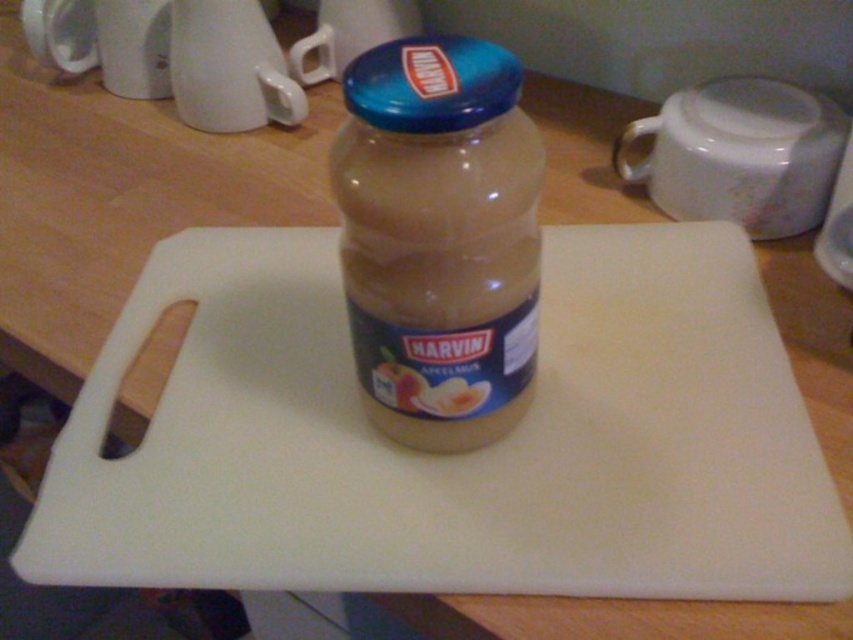
Question: Is translucent glass jar at center positioned at the back of blue metallic lid at center?

Choices:
 (A) no
 (B) yes

Answer: (B)

Question: Which object appears farthest from the camera in this image?

Choices:
 (A) white glossy mug at upper center
 (B) matte plastic jar at center
 (C) translucent glass jar at center
 (D) white glossy mug at upper right

Answer: (A)

Question: Does white glossy mug at upper right appear under white glossy mug at upper center?

Choices:
 (A) yes
 (B) no

Answer: (A)

Question: Can you confirm if translucent glass jar at center is positioned to the left of blue metallic lid at center?

Choices:
 (A) no
 (B) yes

Answer: (A)

Question: Which point appears closest to the camera in this image?

Choices:
 (A) (421, 100)
 (B) (274, 42)

Answer: (A)

Question: Which object is positioned farthest from the blue metallic lid at center?

Choices:
 (A) white glossy mug at upper center
 (B) matte plastic jar at center

Answer: (A)